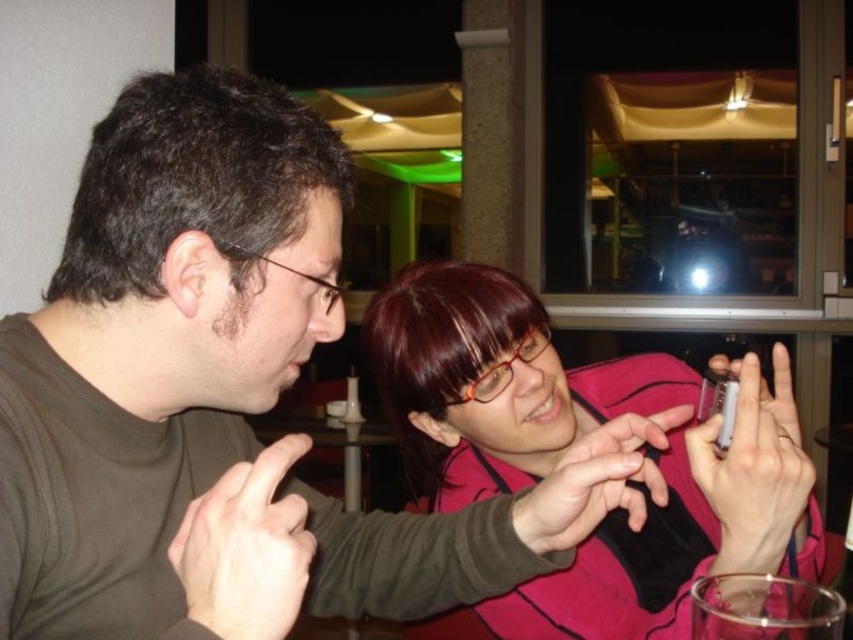
Does pink matte jacket at center appear under wooden table at center?

Actually, pink matte jacket at center is above wooden table at center.

Who is higher up, pink matte jacket at center or wooden table at center?

Positioned higher is pink matte jacket at center.

Find the location of `pink matte jacket at center`. pink matte jacket at center is located at coordinates (492, 381).